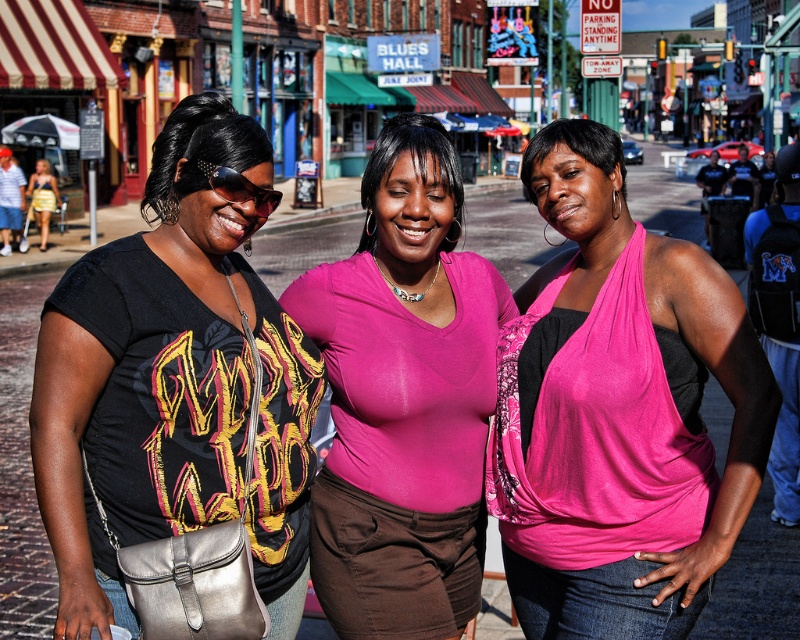
This screenshot has height=640, width=800. Describe the element at coordinates (618, 412) in the screenshot. I see `pink satin halter top at center` at that location.

Which is behind, point (620, 620) or point (300, 600)?

The point (300, 600) is behind.

This screenshot has width=800, height=640. Identify the location of pink satin halter top at center. (618, 412).

Can you confirm if matte black shirt at center is taller than pink matte shirt at center?

Yes, matte black shirt at center is taller than pink matte shirt at center.

Is point (268, 189) behind point (326, 362)?

No.

Does point (88, 352) come in front of point (478, 570)?

That is True.

Where is `matte black shirt at center`? matte black shirt at center is located at coordinates (176, 381).

Is pink satin halter top at center positioned in front of pink matte shirt at center?

Yes, it is.

Find the location of `pink satin halter top at center`. pink satin halter top at center is located at coordinates (618, 412).